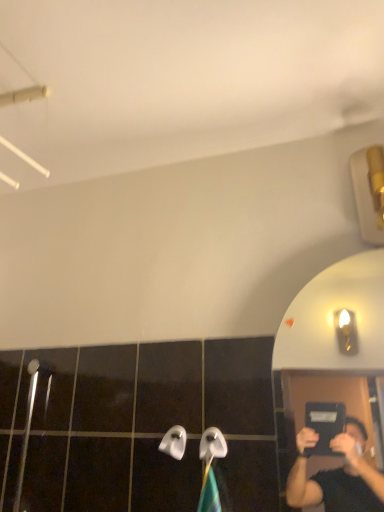
The image size is (384, 512). I want to click on white plastic towel bar at center, acting as the 1th towel bar starting from the left, so click(x=174, y=442).

What do you see at coordinates (174, 442) in the screenshot? I see `white plastic towel bar at center, the second towel bar viewed from the right` at bounding box center [174, 442].

You are a GUI agent. You are given a task and a screenshot of the screen. Output one action in this format:
    pyautogui.click(x=<x>, y=<y>)
    Task: Click on the white plastic towel bar at center, which appears as the 1th towel bar when viewed from the right
    
    Given the screenshot: What is the action you would take?
    pyautogui.click(x=212, y=445)

The width and height of the screenshot is (384, 512). What do you see at coordinates (212, 445) in the screenshot?
I see `white plastic towel bar at center, which appears as the 2th towel bar when viewed from the left` at bounding box center [212, 445].

What is the approximate width of white plastic towel bar at center, which appears as the 2th towel bar when viewed from the left?

white plastic towel bar at center, which appears as the 2th towel bar when viewed from the left, is 1.40 inches wide.

Measure the distance between point (218, 445) and camera.

Point (218, 445) and camera are 3.54 feet apart from each other.

Find the location of a particular element. white plastic towel bar at center, acting as the 1th towel bar starting from the left is located at coordinates [174, 442].

Can you confirm if white plastic towel bar at center, acting as the 1th towel bar starting from the left, is positioned to the right of white plastic towel bar at center, which appears as the 1th towel bar when viewed from the right?

No.

Is white plastic towel bar at center, acting as the 1th towel bar starting from the left, closer to the viewer compared to white plastic towel bar at center, which appears as the 2th towel bar when viewed from the left?

No, it is not.

Does point (166, 439) appear closer or farther from the camera than point (201, 457)?

Point (166, 439).

From the image's perspective, is white plastic towel bar at center, acting as the 1th towel bar starting from the left, beneath white plastic towel bar at center, which appears as the 2th towel bar when viewed from the left?

Yes, from the image's perspective, white plastic towel bar at center, acting as the 1th towel bar starting from the left, is beneath white plastic towel bar at center, which appears as the 2th towel bar when viewed from the left.

Consider the image. From a real-world perspective, is white plastic towel bar at center, acting as the 1th towel bar starting from the left, positioned above or below white plastic towel bar at center, which appears as the 1th towel bar when viewed from the right?

white plastic towel bar at center, acting as the 1th towel bar starting from the left, is situated higher than white plastic towel bar at center, which appears as the 1th towel bar when viewed from the right, in the real world.

Does white plastic towel bar at center, acting as the 1th towel bar starting from the left, have a greater width compared to white plastic towel bar at center, which appears as the 2th towel bar when viewed from the left?

No.

Is white plastic towel bar at center, the second towel bar viewed from the right, taller or shorter than white plastic towel bar at center, which appears as the 1th towel bar when viewed from the right?

Clearly, white plastic towel bar at center, the second towel bar viewed from the right, is shorter compared to white plastic towel bar at center, which appears as the 1th towel bar when viewed from the right.

Considering the sizes of objects white plastic towel bar at center, acting as the 1th towel bar starting from the left, and white plastic towel bar at center, which appears as the 1th towel bar when viewed from the right, in the image provided, who is smaller, white plastic towel bar at center, acting as the 1th towel bar starting from the left, or white plastic towel bar at center, which appears as the 1th towel bar when viewed from the right,?

With smaller size is white plastic towel bar at center, acting as the 1th towel bar starting from the left.

Which is correct: white plastic towel bar at center, acting as the 1th towel bar starting from the left, is inside white plastic towel bar at center, which appears as the 2th towel bar when viewed from the left, or outside of it?

white plastic towel bar at center, acting as the 1th towel bar starting from the left, exists outside the volume of white plastic towel bar at center, which appears as the 2th towel bar when viewed from the left.

Are white plastic towel bar at center, acting as the 1th towel bar starting from the left, and white plastic towel bar at center, which appears as the 2th towel bar when viewed from the left, far apart?

That's not correct — white plastic towel bar at center, acting as the 1th towel bar starting from the left, is a little close to white plastic towel bar at center, which appears as the 2th towel bar when viewed from the left.

Is white plastic towel bar at center, the second towel bar viewed from the right, oriented towards white plastic towel bar at center, which appears as the 1th towel bar when viewed from the right?

No, white plastic towel bar at center, the second towel bar viewed from the right, is not aimed at white plastic towel bar at center, which appears as the 1th towel bar when viewed from the right.

How distant is white plastic towel bar at center, acting as the 1th towel bar starting from the left, from white plastic towel bar at center, which appears as the 2th towel bar when viewed from the left?

white plastic towel bar at center, acting as the 1th towel bar starting from the left, is 2.93 inches away from white plastic towel bar at center, which appears as the 2th towel bar when viewed from the left.

Where is `towel bar in front of the white plastic towel bar at center, the second towel bar viewed from the right`? towel bar in front of the white plastic towel bar at center, the second towel bar viewed from the right is located at coordinates (212, 445).

Does white plastic towel bar at center, which appears as the 1th towel bar when viewed from the right, appear on the left side of white plastic towel bar at center, the second towel bar viewed from the right?

No, white plastic towel bar at center, which appears as the 1th towel bar when viewed from the right, is not to the left of white plastic towel bar at center, the second towel bar viewed from the right.

Which object is more forward, white plastic towel bar at center, which appears as the 2th towel bar when viewed from the left, or white plastic towel bar at center, the second towel bar viewed from the right?

white plastic towel bar at center, which appears as the 2th towel bar when viewed from the left, is more forward.

Does point (210, 433) appear closer or farther from the camera than point (178, 426)?

Clearly, point (210, 433) is closer to the camera than point (178, 426).

From the image's perspective, is white plastic towel bar at center, which appears as the 1th towel bar when viewed from the right, located above white plastic towel bar at center, acting as the 1th towel bar starting from the left?

Yes, from the image's perspective, white plastic towel bar at center, which appears as the 1th towel bar when viewed from the right, is over white plastic towel bar at center, acting as the 1th towel bar starting from the left.

From a real-world perspective, is white plastic towel bar at center, which appears as the 2th towel bar when viewed from the left, positioned under white plastic towel bar at center, the second towel bar viewed from the right, based on gravity?

Yes, from a real-world perspective, white plastic towel bar at center, which appears as the 2th towel bar when viewed from the left, is below white plastic towel bar at center, the second towel bar viewed from the right.

Between white plastic towel bar at center, which appears as the 1th towel bar when viewed from the right, and white plastic towel bar at center, the second towel bar viewed from the right, which one has larger width?

white plastic towel bar at center, which appears as the 1th towel bar when viewed from the right, is wider.

Considering the sizes of objects white plastic towel bar at center, which appears as the 2th towel bar when viewed from the left, and white plastic towel bar at center, the second towel bar viewed from the right, in the image provided, who is shorter, white plastic towel bar at center, which appears as the 2th towel bar when viewed from the left, or white plastic towel bar at center, the second towel bar viewed from the right,?

Standing shorter between the two is white plastic towel bar at center, the second towel bar viewed from the right.

Considering the sizes of objects white plastic towel bar at center, which appears as the 2th towel bar when viewed from the left, and white plastic towel bar at center, acting as the 1th towel bar starting from the left, in the image provided, who is smaller, white plastic towel bar at center, which appears as the 2th towel bar when viewed from the left, or white plastic towel bar at center, acting as the 1th towel bar starting from the left,?

With smaller size is white plastic towel bar at center, acting as the 1th towel bar starting from the left.

Is white plastic towel bar at center, which appears as the 1th towel bar when viewed from the right, situated inside white plastic towel bar at center, acting as the 1th towel bar starting from the left, or outside?

white plastic towel bar at center, which appears as the 1th towel bar when viewed from the right, lies outside white plastic towel bar at center, acting as the 1th towel bar starting from the left.

Is white plastic towel bar at center, which appears as the 2th towel bar when viewed from the left, not near white plastic towel bar at center, acting as the 1th towel bar starting from the left?

white plastic towel bar at center, which appears as the 2th towel bar when viewed from the left, is actually quite close to white plastic towel bar at center, acting as the 1th towel bar starting from the left.

Is white plastic towel bar at center, which appears as the 1th towel bar when viewed from the right, turned away from white plastic towel bar at center, the second towel bar viewed from the right?

white plastic towel bar at center, which appears as the 1th towel bar when viewed from the right, does not have its back to white plastic towel bar at center, the second towel bar viewed from the right.

How different are the orientations of white plastic towel bar at center, which appears as the 2th towel bar when viewed from the left, and white plastic towel bar at center, the second towel bar viewed from the right, in degrees?

They differ by 4.13 degrees in their facing directions.

How much distance is there between white plastic towel bar at center, which appears as the 2th towel bar when viewed from the left, and white plastic towel bar at center, the second towel bar viewed from the right?

The distance of white plastic towel bar at center, which appears as the 2th towel bar when viewed from the left, from white plastic towel bar at center, the second towel bar viewed from the right, is 7.45 centimeters.

This screenshot has width=384, height=512. I want to click on towel bar located behind the white plastic towel bar at center, which appears as the 2th towel bar when viewed from the left, so click(174, 442).

You are a GUI agent. You are given a task and a screenshot of the screen. Output one action in this format:
    pyautogui.click(x=<x>, y=<y>)
    Task: Click on the towel bar above the white plastic towel bar at center, the second towel bar viewed from the right (from the image's perspective)
    The width and height of the screenshot is (384, 512).
    Given the screenshot: What is the action you would take?
    pyautogui.click(x=212, y=445)

Locate an element on the screen. The image size is (384, 512). towel bar located underneath the white plastic towel bar at center, acting as the 1th towel bar starting from the left (from a real-world perspective) is located at coordinates (212, 445).